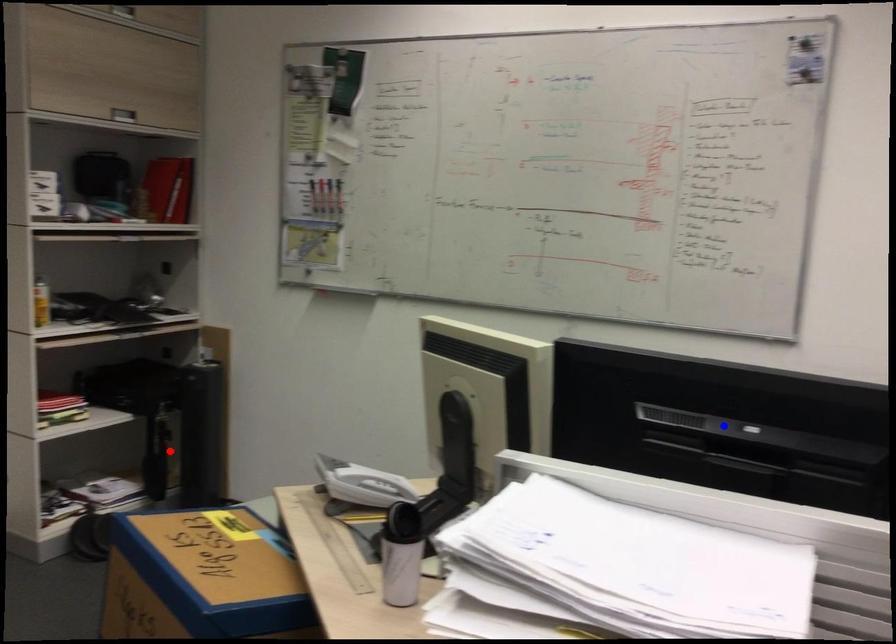
Question: Two points are marked on the image. Which point is closer to the camera?

Choices:
 (A) Blue point is closer.
 (B) Red point is closer.

Answer: (A)